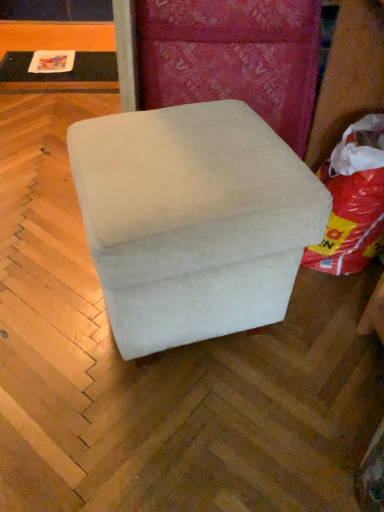
Question: Is white fabric bean bag at right facing towards white fabric ottoman at center?

Choices:
 (A) no
 (B) yes

Answer: (B)

Question: Would you consider white fabric bean bag at right to be distant from white fabric ottoman at center?

Choices:
 (A) yes
 (B) no

Answer: (B)

Question: Can you confirm if white fabric bean bag at right is smaller than white fabric ottoman at center?

Choices:
 (A) no
 (B) yes

Answer: (B)

Question: From a real-world perspective, is white fabric bean bag at right positioned over white fabric ottoman at center based on gravity?

Choices:
 (A) yes
 (B) no

Answer: (B)

Question: Can you confirm if white fabric bean bag at right is wider than white fabric ottoman at center?

Choices:
 (A) no
 (B) yes

Answer: (A)

Question: Would you say white fabric bean bag at right contains white fabric ottoman at center?

Choices:
 (A) no
 (B) yes

Answer: (A)

Question: Would you consider white fabric bean bag at right to be distant from matte black table at upper left?

Choices:
 (A) no
 (B) yes

Answer: (B)

Question: Can you confirm if white fabric bean bag at right is positioned to the left of matte black table at upper left?

Choices:
 (A) yes
 (B) no

Answer: (B)

Question: Can you confirm if white fabric bean bag at right is wider than matte black table at upper left?

Choices:
 (A) no
 (B) yes

Answer: (A)

Question: Considering the relative sizes of white fabric bean bag at right and matte black table at upper left in the image provided, is white fabric bean bag at right smaller than matte black table at upper left?

Choices:
 (A) yes
 (B) no

Answer: (B)

Question: Is white fabric bean bag at right thinner than matte black table at upper left?

Choices:
 (A) no
 (B) yes

Answer: (B)

Question: From the image's perspective, is white fabric bean bag at right under matte black table at upper left?

Choices:
 (A) yes
 (B) no

Answer: (A)

Question: Is matte black table at upper left oriented away from white fabric bean bag at right?

Choices:
 (A) no
 (B) yes

Answer: (A)